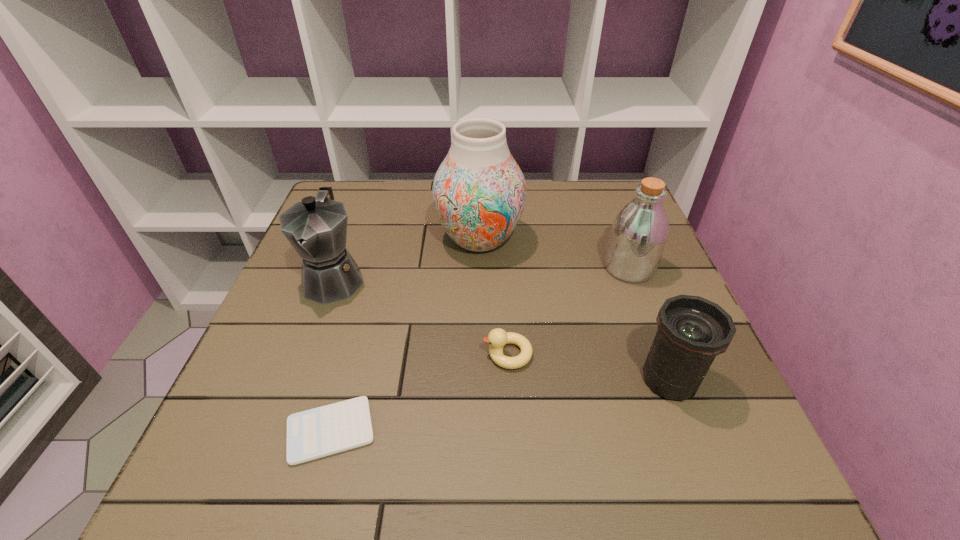
The width and height of the screenshot is (960, 540). What are the coordinates of `blank area located at the beak of the duckling` in the screenshot? It's located at (344, 354).

Identify the location of free region located 0.360m at the beak of the duckling. The width and height of the screenshot is (960, 540). (298, 354).

Locate an element on the screen. The image size is (960, 540). free space located at the beak of the duckling is located at coordinates (380, 354).

Find the location of `free space located 0.290m on the back of the shortest object`. free space located 0.290m on the back of the shortest object is located at coordinates (370, 287).

Image resolution: width=960 pixels, height=540 pixels. What are the coordinates of `object present at the far edge` in the screenshot? It's located at (479, 192).

Where is `object at the near edge`? object at the near edge is located at coordinates point(319,432).

At what (x,y) coordinates should I click in order to perform the action: click on coffeepot situated at the left edge. Please return your answer as a coordinate pair (x, y). This screenshot has height=540, width=960. Looking at the image, I should click on (316, 228).

You are a GUI agent. You are given a task and a screenshot of the screen. Output one action in this format:
    pyautogui.click(x=<x>, y=<y>)
    Task: Click on the calculator present at the left edge
    This screenshot has height=540, width=960.
    Given the screenshot: What is the action you would take?
    pyautogui.click(x=319, y=432)

Where is `bottle that is at the right edge`? The image size is (960, 540). bottle that is at the right edge is located at coordinates (639, 233).

You are a GUI agent. You are given a task and a screenshot of the screen. Output one action in this format:
    pyautogui.click(x=<x>, y=<y>)
    Task: Click on the telephoto lens that is at the right edge
    The width and height of the screenshot is (960, 540).
    Given the screenshot: What is the action you would take?
    pyautogui.click(x=692, y=331)